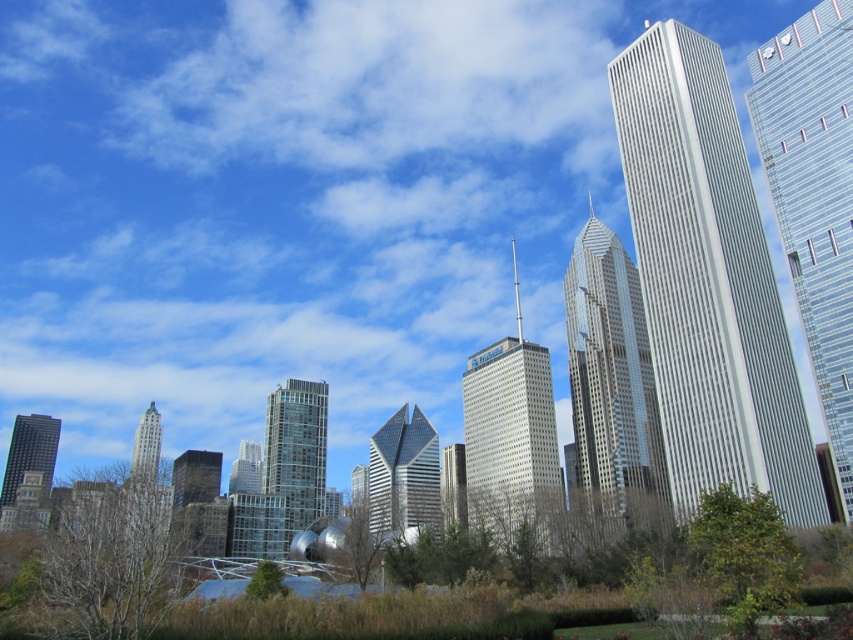
You are a city planner assessing the skyline. Which of the two skyscrapers, the transparent glass skyscraper at right or the gold reflective glass skyscraper at center, would cast a longer shadow during midday? Please explain your reasoning based on their heights.

The transparent glass skyscraper at right is much taller than the gold reflective glass skyscraper at center, so it would cast a longer shadow during midday because taller objects generally cast longer shadows when the sun is directly overhead.